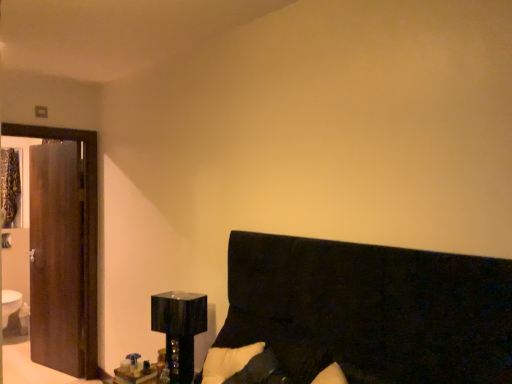
Question: Is dark wood door at left spatially inside black fabric headboard at lower right, or outside of it?

Choices:
 (A) outside
 (B) inside

Answer: (A)

Question: Is dark wood door at left to the left or to the right of black fabric headboard at lower right in the image?

Choices:
 (A) left
 (B) right

Answer: (A)

Question: Considering the real-world distances, which object is farthest from the wooden glossy table at lower left?

Choices:
 (A) white glossy sink at lower left
 (B) glossy black cube at lower left
 (C) black fabric headboard at lower right
 (D) dark wood door at left

Answer: (A)

Question: Estimate the real-world distances between objects in this image. Which object is closer to the wooden glossy table at lower left?

Choices:
 (A) dark wood door at left
 (B) white glossy sink at lower left
 (C) glossy black cube at lower left
 (D) black fabric headboard at lower right

Answer: (C)